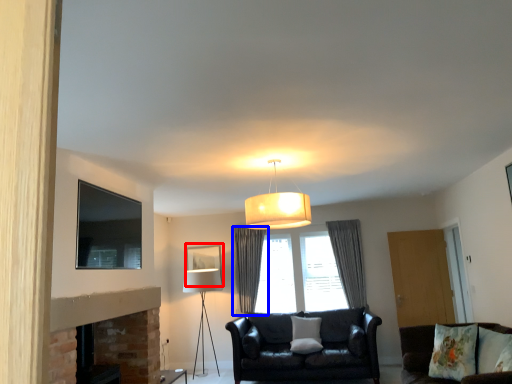
Question: Which object is closer to the camera taking this photo, picture frame (highlighted by a red box) or curtain (highlighted by a blue box)?

Choices:
 (A) picture frame
 (B) curtain

Answer: (B)